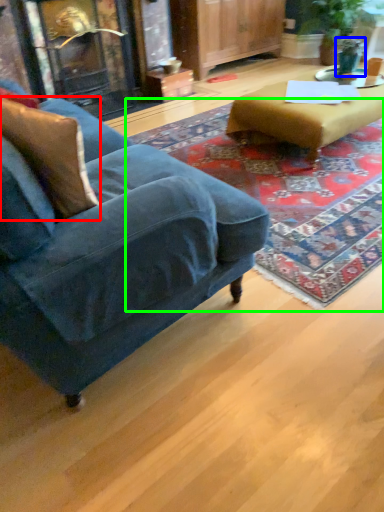
Question: Estimate the real-world distances between objects in this image. Which object is farther from pillow (highlighted by a red box), teal (highlighted by a blue box) or mat (highlighted by a green box)?

Choices:
 (A) teal
 (B) mat

Answer: (A)